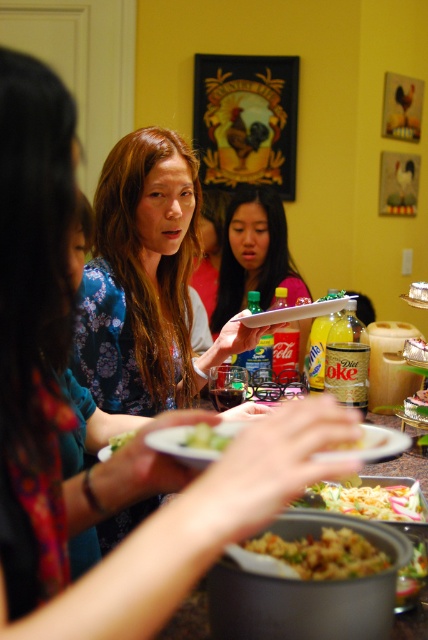
You are a guest at the table and want to grab the shiny metallic spoon at center to serve yourself. However, there is also the green leafy salad at center in the way. Can you reach the spoon without moving the salad?

The shiny metallic spoon at center is much taller than the green leafy salad at center, so you can reach the spoon by going around or over the salad since it is taller and might not block the path completely.

In the scene shown: You are at a family gathering and want to compare the height of the green leafy vegetable at center and the green leafy salad at center on the table. Which one is taller?

The green leafy salad at center is taller than the green leafy vegetable at center.

You are a guest at the gathering and want to place a small napkin between the shiny metallic bowl at center and the green leafy vegetable at center. Which object should you move to make space?

Since the shiny metallic bowl at center is wider than the green leafy vegetable at center, you should move the shiny metallic bowl at center to create more space for the napkin.